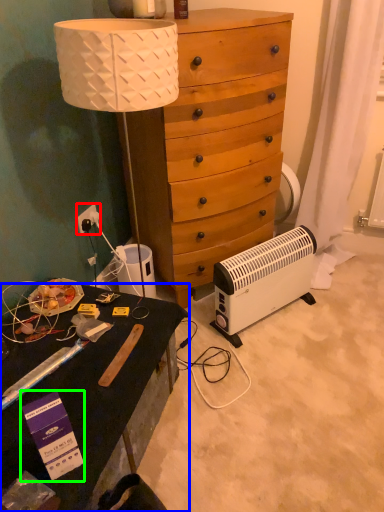
Question: Which object is positioned farthest from power outlet (highlighted by a red box)? Select from desk (highlighted by a blue box) and box (highlighted by a green box).

Choices:
 (A) desk
 (B) box

Answer: (B)